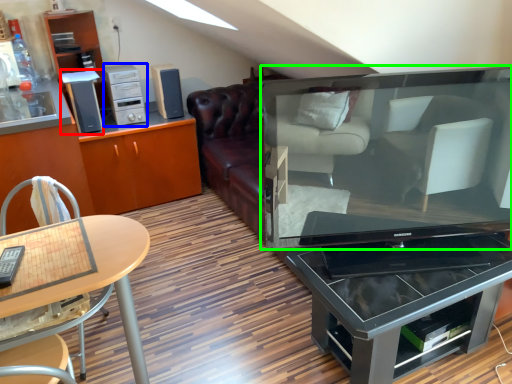
Question: Considering the real-world distances, which object is farthest from appliance (highlighted by a red box)? appliance (highlighted by a blue box) or television (highlighted by a green box)?

Choices:
 (A) appliance
 (B) television

Answer: (B)